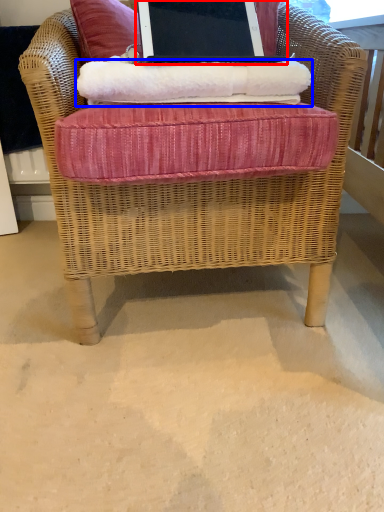
Question: Which object appears farthest to the camera in this image, laptop (highlighted by a red box) or material (highlighted by a blue box)?

Choices:
 (A) laptop
 (B) material

Answer: (B)